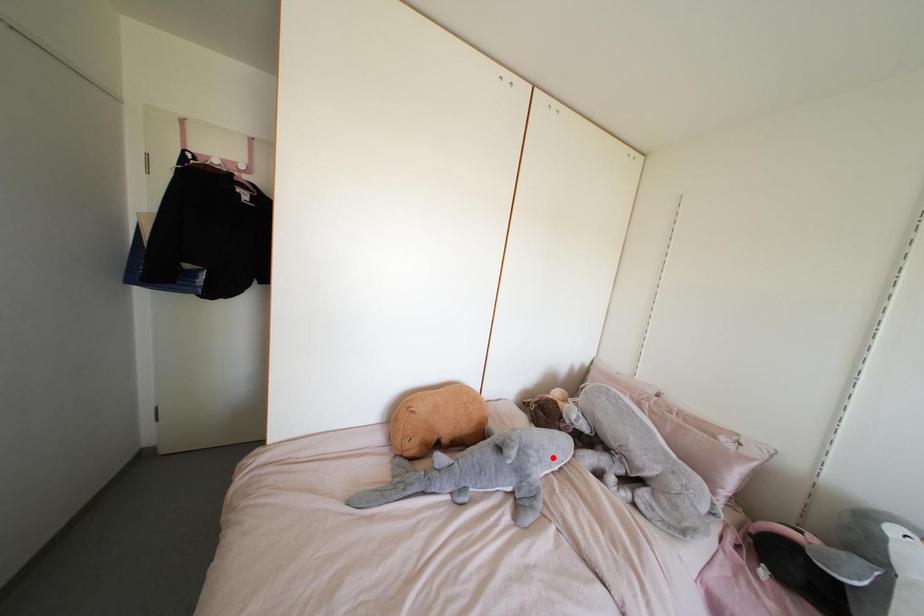
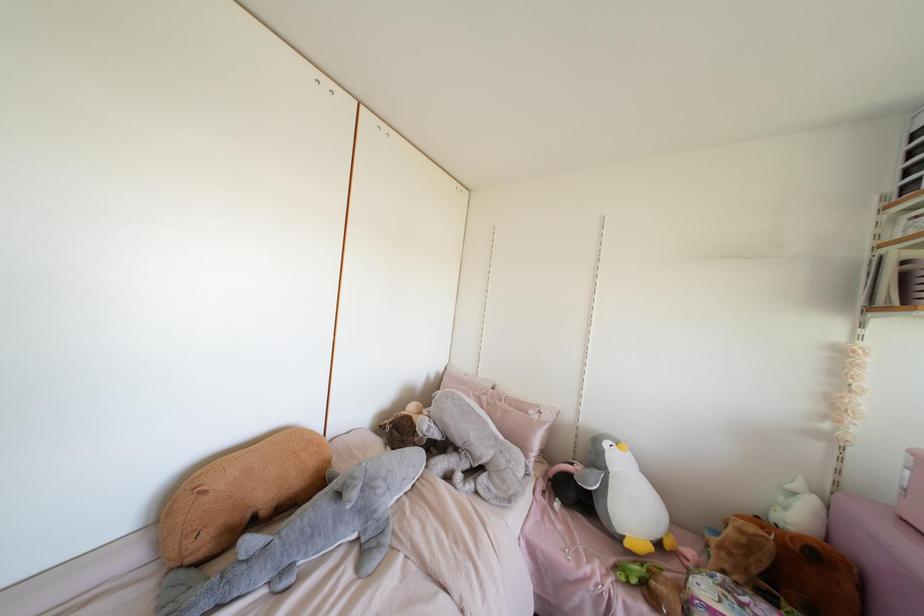
Question: I am providing you with two images of the same scene from different viewpoints. In image1, a red point is highlighted. Considering the same 3D point in image2, which of the following is correct?

Choices:
 (A) It is closer
 (B) It is farther

Answer: (A)